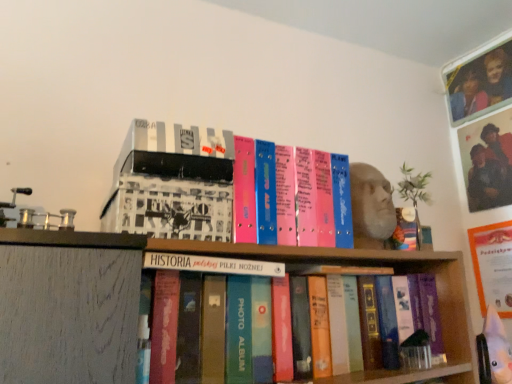
Question: From the image's perspective, relative to white matte box at upper left, which ranks as the 2th book in bottom-to-top order, is hardcover book at center, which ranks as the first book in bottom-to-top order, above or below?

Choices:
 (A) above
 (B) below

Answer: (B)

Question: Relative to white matte box at upper left, which ranks as the 2th book in bottom-to-top order, is hardcover book at center, which is the 2th book in top-to-bottom order, in front or behind?

Choices:
 (A) behind
 (B) front

Answer: (A)

Question: Considering the real-world distances, which object is closest to the white matte box at upper left, acting as the first book starting from the top?

Choices:
 (A) hardcover book at center, which is the 2th book in top-to-bottom order
 (B) matte plastic photo frame at upper right
 (C) orange matte paper at upper right

Answer: (A)

Question: Based on their relative distances, which object is nearer to the orange matte paper at upper right?

Choices:
 (A) hardcover book at center, which ranks as the first book in bottom-to-top order
 (B) matte plastic photo frame at upper right
 (C) white matte box at upper left, acting as the first book starting from the top

Answer: (B)